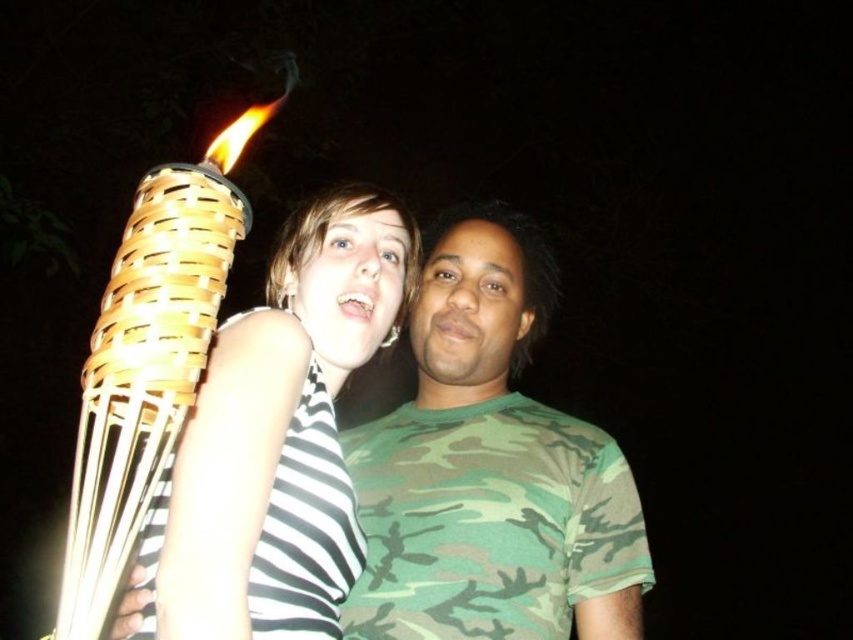
Between camouflage fabric shirt at center and matte woven torch at left, which one appears on the left side from the viewer's perspective?

matte woven torch at left is more to the left.

Is point (426, 513) farther from viewer compared to point (251, 582)?

Yes, point (426, 513) is farther from viewer.

At what (x,y) coordinates should I click in order to perform the action: click on camouflage fabric shirt at center. Please return your answer as a coordinate pair (x, y). Looking at the image, I should click on (490, 467).

Locate an element on the screen. The image size is (853, 640). camouflage fabric shirt at center is located at coordinates (490, 467).

Is camouflage fabric shirt at center closer to camera compared to woven bamboo torch at left?

No, it is not.

Between camouflage fabric shirt at center and woven bamboo torch at left, which one is positioned higher?

woven bamboo torch at left is above.

Does point (454, 323) come behind point (111, 422)?

That is True.

Identify the location of camouflage fabric shirt at center. (490, 467).

Between matte woven torch at left and woven bamboo torch at left, which one is positioned higher?

woven bamboo torch at left is higher up.

Which is behind, point (234, 508) or point (123, 380)?

The point (234, 508) is behind.

Find the location of a particular element. The image size is (853, 640). matte woven torch at left is located at coordinates (276, 440).